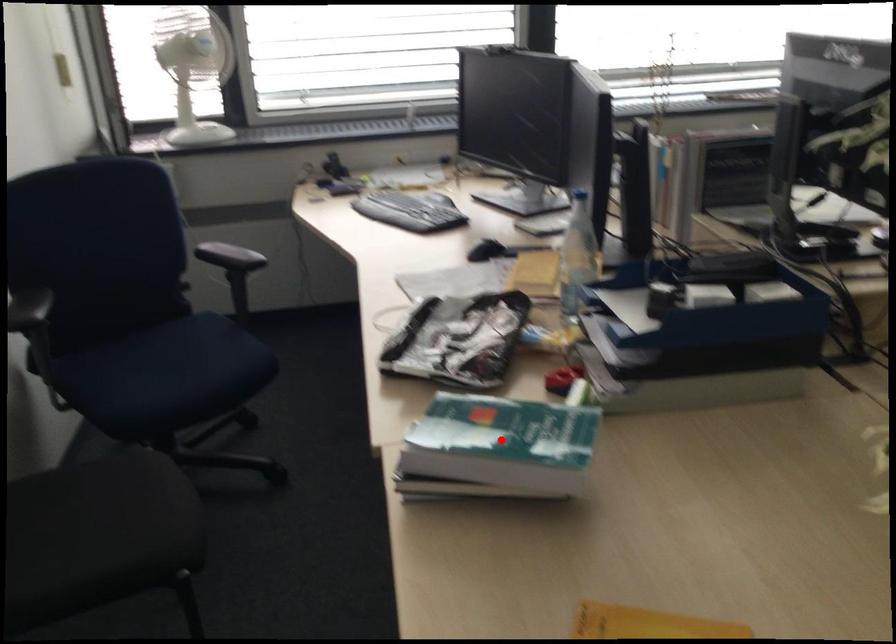
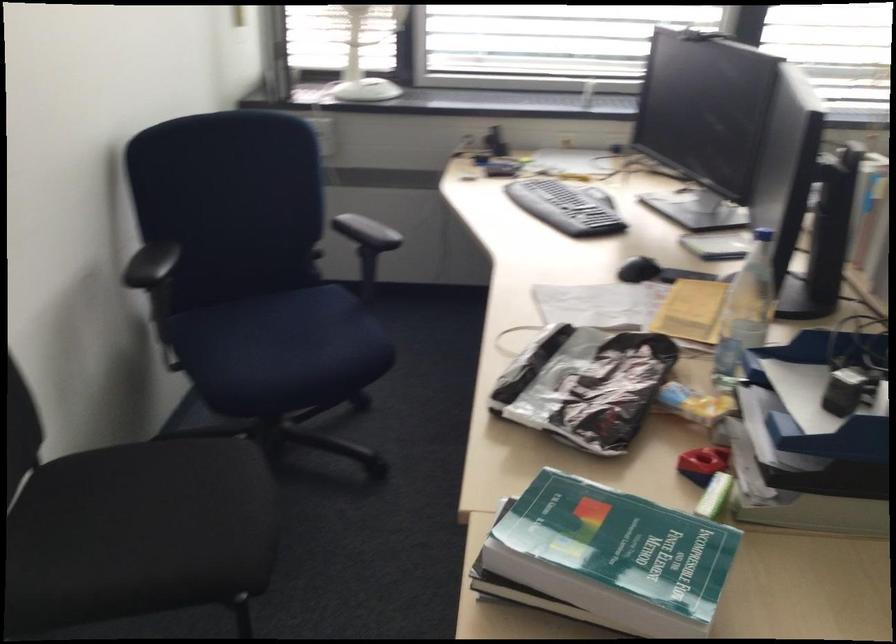
Where in the second image is the point corresponding to the highlighted location from the first image?

(614, 556)